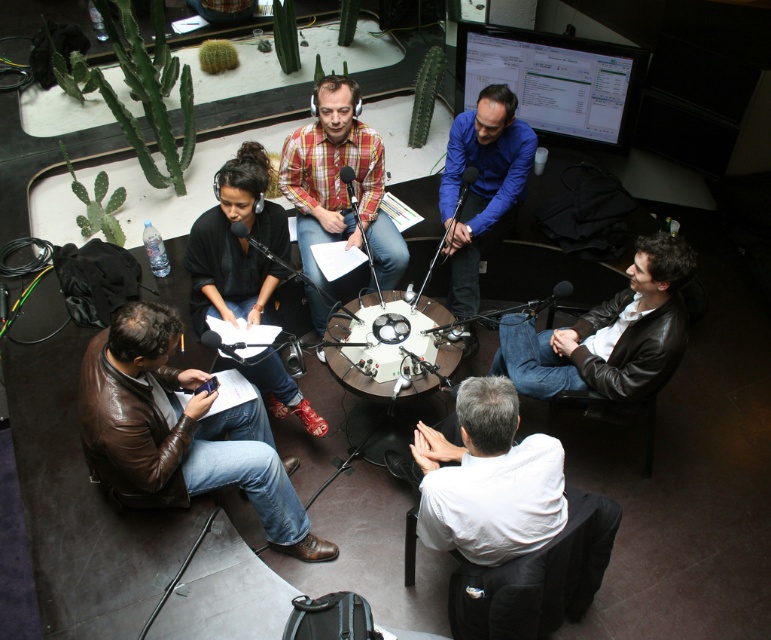
Question: Which point is farther to the camera?

Choices:
 (A) (436, 352)
 (B) (254, 228)
 (C) (369, 170)

Answer: (C)

Question: Which of the following is the farthest from the observer?

Choices:
 (A) black leather jacket at lower left
 (B) white glossy round table at center
 (C) plaid shirt at center
 (D) white matte shirt at lower center

Answer: (C)

Question: Can you confirm if black leather jacket at lower left is thinner than white glossy round table at center?

Choices:
 (A) no
 (B) yes

Answer: (A)

Question: Can you confirm if plaid shirt at center is positioned to the right of white glossy round table at center?

Choices:
 (A) no
 (B) yes

Answer: (A)

Question: Which object is the closest to the blue matte shirt at center?

Choices:
 (A) white matte shirt at lower center
 (B) black leather jacket at lower left
 (C) brown leather jacket at lower left
 (D) plaid shirt at center

Answer: (D)

Question: Can you confirm if brown leather jacket at lower left is positioned to the left of black leather jacket at lower left?

Choices:
 (A) yes
 (B) no

Answer: (A)